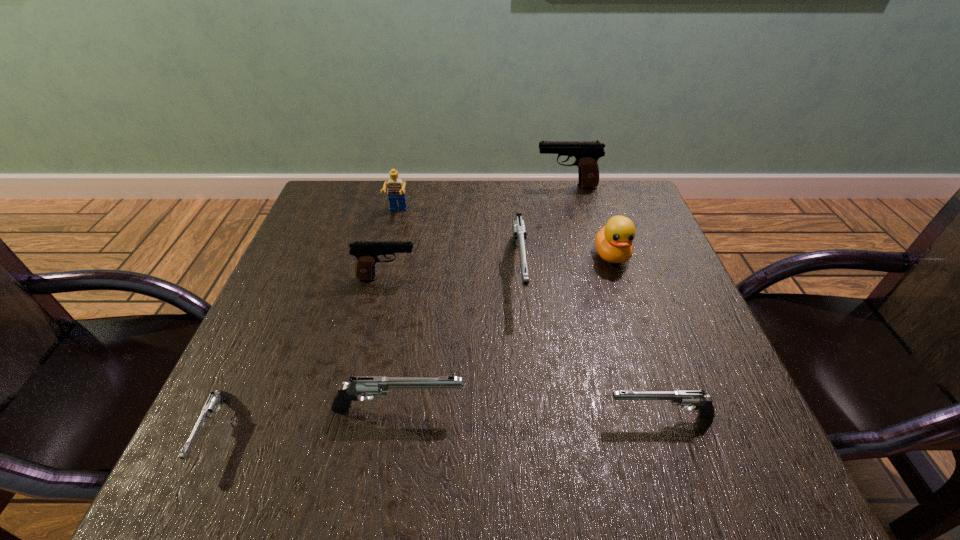
At what (x,y) coordinates should I click in order to perform the action: click on object that is the second closest to the seventh nearest object. Please return your answer as a coordinate pair (x, y). Looking at the image, I should click on (519, 231).

Choose which object is the sixth nearest neighbor to the bigger black pistol. Please provide its 2D coordinates. Your answer should be formatted as a tuple, i.e. [(x, y)], where the tuple contains the x and y coordinates of a point satisfying the conditions above.

[(359, 385)]

The image size is (960, 540). I want to click on pistol that can be found as the closest to the fourth object from right to left, so click(367, 252).

The width and height of the screenshot is (960, 540). Find the location of `pistol that is the fifth closest to the smallest silver pistol`. pistol that is the fifth closest to the smallest silver pistol is located at coordinates (586, 153).

At what (x,y) coordinates should I click in order to perform the action: click on silver pistol that is the closest to the leftmost object. Please return your answer as a coordinate pair (x, y). Image resolution: width=960 pixels, height=540 pixels. Looking at the image, I should click on (359, 385).

Locate which silver pistol ranks second in proximity to the duckling. Please provide its 2D coordinates. Your answer should be formatted as a tuple, i.e. [(x, y)], where the tuple contains the x and y coordinates of a point satisfying the conditions above.

[(703, 404)]

Locate an element on the screen. This screenshot has width=960, height=540. free space that satisfies the following two spatial constraints: 1. on the front-facing side of the second smallest silver pistol; 2. on the front-facing side of the leftmost object is located at coordinates (664, 431).

The height and width of the screenshot is (540, 960). Identify the location of free spot that satisfies the following two spatial constraints: 1. on the front-facing side of the fourth tallest pistol; 2. on the front-facing side of the leftmost silver pistol. (395, 431).

Where is `free space that satisfies the following two spatial constraints: 1. on the face of the duckling; 2. at the barrel of the nearer black pistol`? free space that satisfies the following two spatial constraints: 1. on the face of the duckling; 2. at the barrel of the nearer black pistol is located at coordinates (619, 278).